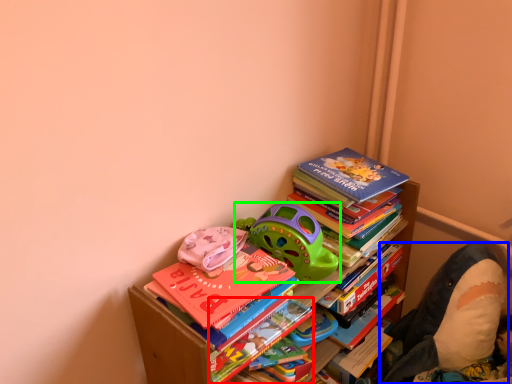
Question: Which object is positioned farthest from paperback book (highlighted by a red box)? Select from toy (highlighted by a blue box) and toy (highlighted by a green box).

Choices:
 (A) toy
 (B) toy

Answer: (A)